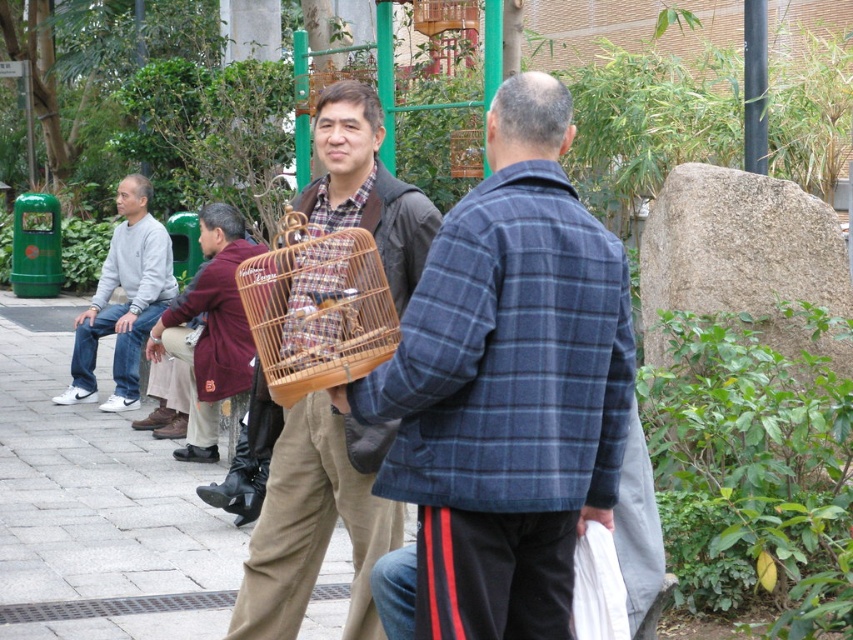
Question: Is bamboo wicker birdcage at center below matte gray sweatshirt at left?

Choices:
 (A) yes
 (B) no

Answer: (A)

Question: Which object appears farthest from the camera in this image?

Choices:
 (A) maroon fabric jacket at center
 (B) plaid woolen jacket at center
 (C) matte gray sweatshirt at left

Answer: (C)

Question: Which object is positioned farthest from the wooden birdcage at center?

Choices:
 (A) bamboo wicker birdcage at center
 (B) matte gray sweatshirt at left

Answer: (B)

Question: Which object is closer to the camera taking this photo?

Choices:
 (A) maroon fabric jacket at center
 (B) matte gray sweatshirt at left
 (C) plaid woolen jacket at center

Answer: (C)

Question: Where is plaid woolen jacket at center located in relation to matte gray sweatshirt at left in the image?

Choices:
 (A) right
 (B) left

Answer: (A)

Question: Is wooden birdcage at center above bamboo wicker birdcage at center?

Choices:
 (A) yes
 (B) no

Answer: (B)